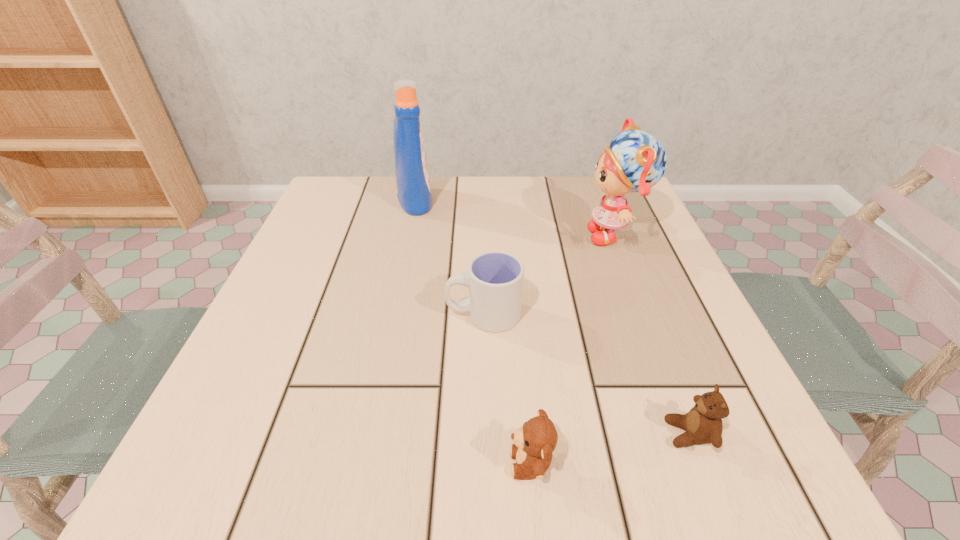
Locate an element on the screen. free space at the far right corner is located at coordinates (570, 179).

Where is `free space between the left teddy bear and the fourth shortest object`? free space between the left teddy bear and the fourth shortest object is located at coordinates (572, 349).

Locate an element on the screen. free point between the tallest object and the doll is located at coordinates (x=515, y=217).

You are a GUI agent. You are given a task and a screenshot of the screen. Output one action in this format:
    pyautogui.click(x=<x>, y=<y>)
    Task: Click on the vacant space in between the right teddy bear and the cup
    Image resolution: width=960 pixels, height=540 pixels.
    Given the screenshot: What is the action you would take?
    pyautogui.click(x=587, y=374)

The image size is (960, 540). In order to click on vacant area that lies between the left teddy bear and the right teddy bear in this screenshot , I will do `click(610, 448)`.

The image size is (960, 540). Identify the location of free point between the left teddy bear and the third nearest object. (507, 389).

I want to click on free point between the third nearest object and the doll, so click(549, 274).

Identify the location of free space between the fourth shortest object and the cup. (549, 274).

The image size is (960, 540). Identify the location of empty space between the right teddy bear and the detergent. (552, 317).

Locate an element on the screen. free point between the left teddy bear and the right teddy bear is located at coordinates (610, 448).